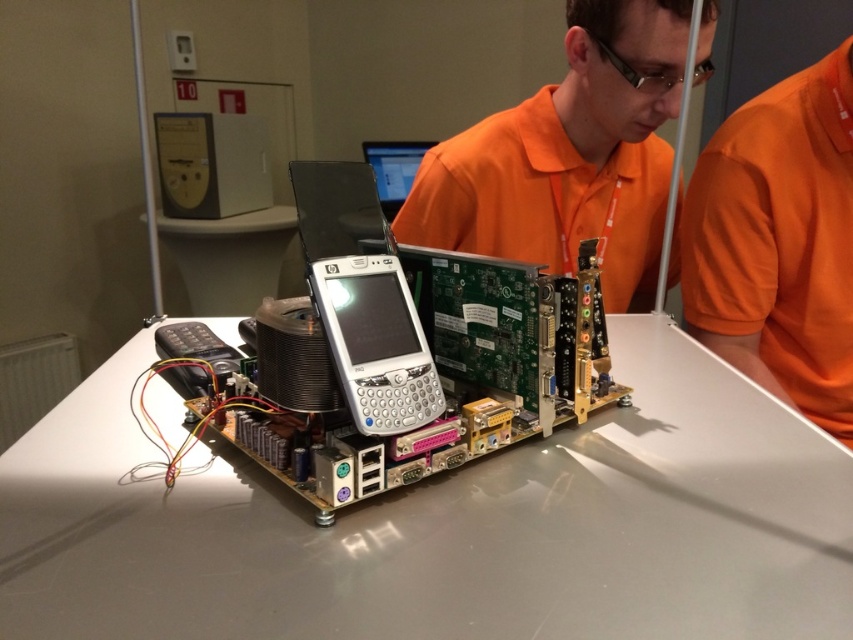
Question: Is the position of white glossy table at center less distant than that of orange fabric shirt at upper right?

Choices:
 (A) no
 (B) yes

Answer: (B)

Question: Based on their relative distances, which object is farther from the white glossy table at center?

Choices:
 (A) orange fabric shirt at upper center
 (B) orange fabric shirt at upper right

Answer: (B)

Question: Which object appears closest to the camera in this image?

Choices:
 (A) orange fabric shirt at upper center
 (B) orange fabric shirt at upper right

Answer: (A)

Question: Considering the relative positions of white glossy table at center and orange fabric shirt at upper center in the image provided, where is white glossy table at center located with respect to orange fabric shirt at upper center?

Choices:
 (A) below
 (B) above

Answer: (A)

Question: Does white glossy table at center appear under orange fabric shirt at upper center?

Choices:
 (A) no
 (B) yes

Answer: (B)

Question: Which point is closer to the camera?

Choices:
 (A) white glossy table at center
 (B) orange fabric shirt at upper right
 (C) orange fabric shirt at upper center

Answer: (A)